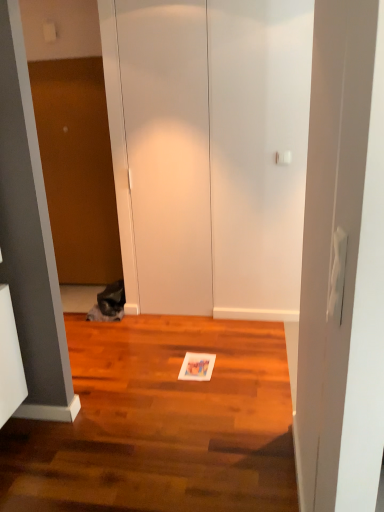
The width and height of the screenshot is (384, 512). In order to click on vacant area that is situated to the right of white matte door at center in this screenshot , I will do `click(218, 325)`.